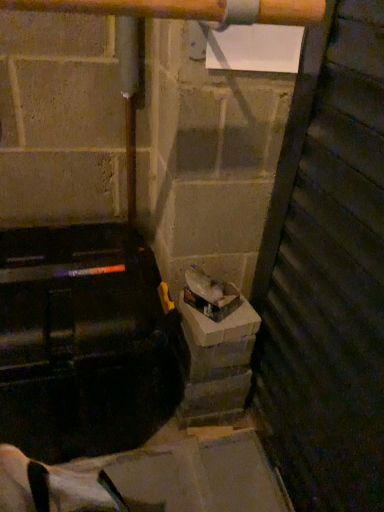
Question: Can you confirm if wooden door at right is taller than shiny plastic bag at center?

Choices:
 (A) no
 (B) yes

Answer: (B)

Question: Is wooden door at right outside of shiny plastic bag at center?

Choices:
 (A) yes
 (B) no

Answer: (A)

Question: From a real-world perspective, does wooden door at right sit lower than shiny plastic bag at center?

Choices:
 (A) no
 (B) yes

Answer: (A)

Question: Does wooden door at right appear on the left side of shiny plastic bag at center?

Choices:
 (A) yes
 (B) no

Answer: (B)

Question: Could you tell me if wooden door at right is facing shiny plastic bag at center?

Choices:
 (A) no
 (B) yes

Answer: (B)

Question: From the image's perspective, relative to shiny plastic bag at center, is concreteroughconcrete block at center above or below?

Choices:
 (A) above
 (B) below

Answer: (B)

Question: From a real-world perspective, is concreteroughconcrete block at center above or below shiny plastic bag at center?

Choices:
 (A) above
 (B) below

Answer: (B)

Question: From their relative heights in the image, would you say concreteroughconcrete block at center is taller or shorter than shiny plastic bag at center?

Choices:
 (A) short
 (B) tall

Answer: (B)

Question: Based on their sizes in the image, would you say concreteroughconcrete block at center is bigger or smaller than shiny plastic bag at center?

Choices:
 (A) small
 (B) big

Answer: (B)

Question: Looking at the image, does wooden door at right seem bigger or smaller compared to concreteroughconcrete block at center?

Choices:
 (A) big
 (B) small

Answer: (A)

Question: Relative to concreteroughconcrete block at center, is wooden door at right in front or behind?

Choices:
 (A) front
 (B) behind

Answer: (A)

Question: Looking at their shapes, would you say wooden door at right is wider or thinner than concreteroughconcrete block at center?

Choices:
 (A) thin
 (B) wide

Answer: (A)

Question: From a real-world perspective, is wooden door at right positioned above or below concreteroughconcrete block at center?

Choices:
 (A) below
 (B) above

Answer: (B)

Question: Would you say wooden door at right is to the left or to the right of shiny plastic bag at center in the picture?

Choices:
 (A) right
 (B) left

Answer: (A)

Question: Is point (364, 227) closer or farther from the camera than point (210, 291)?

Choices:
 (A) closer
 (B) farther

Answer: (A)